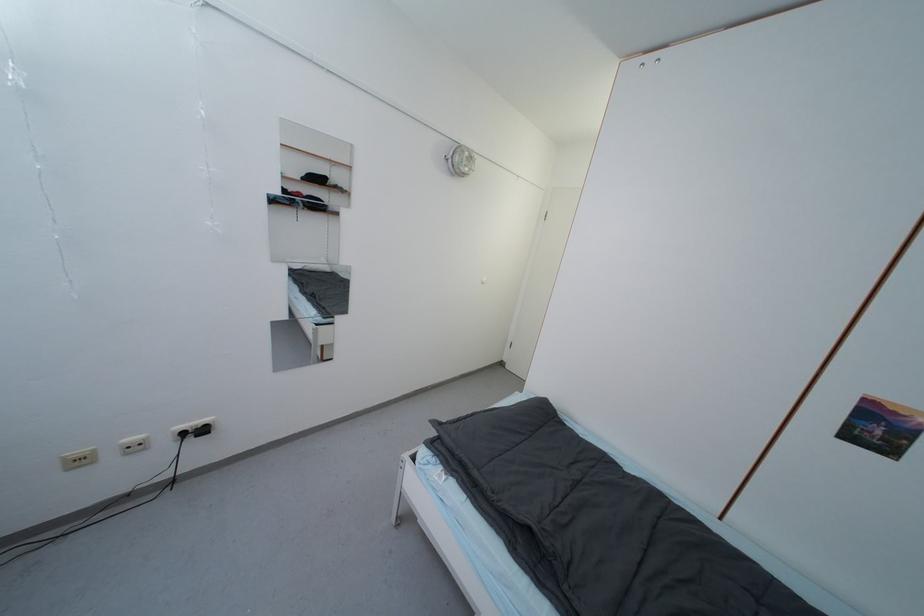
Find the location of a particular element. black electric plug is located at coordinates (186, 436).